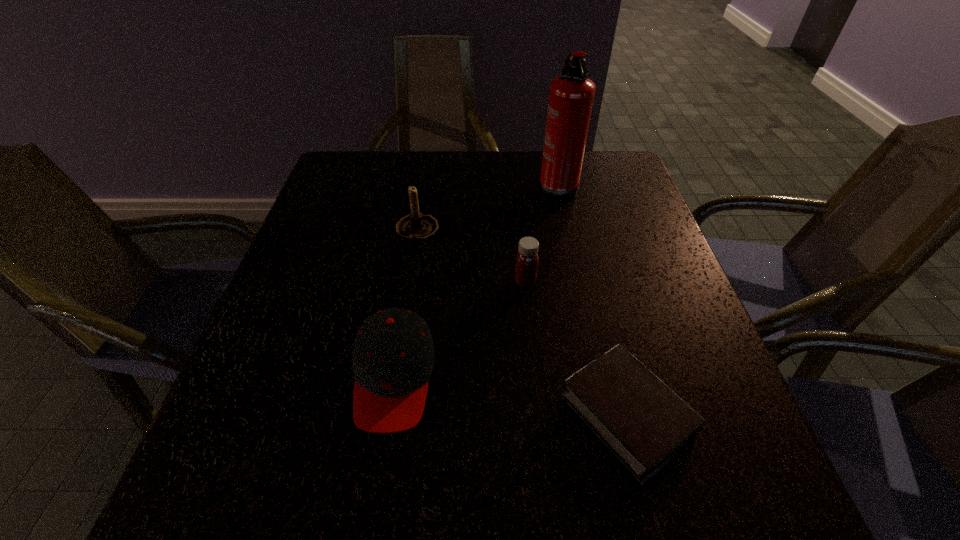
Find the location of a particular element. This screenshot has width=960, height=540. the farthest object is located at coordinates (571, 97).

At what (x,y) coordinates should I click in order to perform the action: click on fire extinguisher. Please return your answer as a coordinate pair (x, y). The height and width of the screenshot is (540, 960). Looking at the image, I should click on (571, 97).

Locate an element on the screen. Image resolution: width=960 pixels, height=540 pixels. the second farthest object is located at coordinates (414, 227).

Identify the location of the second tallest object. This screenshot has width=960, height=540. (414, 227).

Locate an element on the screen. This screenshot has height=540, width=960. the third farthest object is located at coordinates (527, 259).

This screenshot has height=540, width=960. I want to click on medicine, so click(527, 259).

The width and height of the screenshot is (960, 540). What are the coordinates of `cap` in the screenshot? It's located at (393, 355).

Where is `the shortest object`? The image size is (960, 540). the shortest object is located at coordinates (644, 423).

I want to click on free space located at the nozzle of the fire extinguisher, so click(504, 186).

The width and height of the screenshot is (960, 540). In order to click on free spot located at the nozzle of the fire extinguisher in this screenshot , I will do `click(390, 186)`.